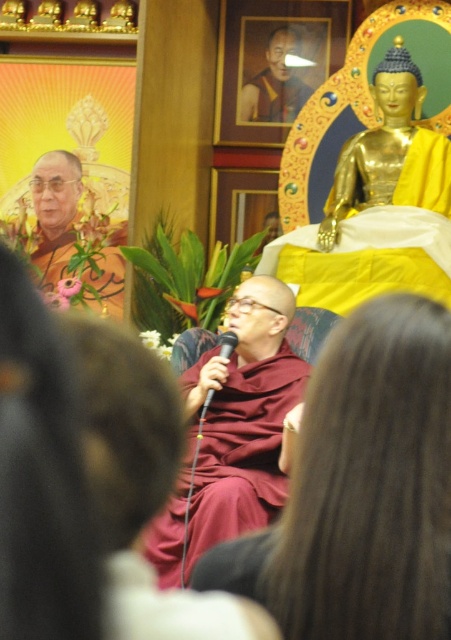
Question: Which point is closer to the camera?

Choices:
 (A) maroon cloth at center
 (B) black plastic microphone at center
 (C) gold polished buddha at upper right
 (D) golden statue at upper left

Answer: (A)

Question: Can you confirm if maroon cloth at center is thinner than golden statue at upper left?

Choices:
 (A) yes
 (B) no

Answer: (B)

Question: Does maroon cloth at center have a larger size compared to golden statue at upper left?

Choices:
 (A) no
 (B) yes

Answer: (B)

Question: Which point is closer to the camera?

Choices:
 (A) gold polished buddha at upper right
 (B) golden statue at upper left

Answer: (A)

Question: Is maroon cloth at center positioned at the back of black plastic microphone at center?

Choices:
 (A) no
 (B) yes

Answer: (A)

Question: Which object is positioned farthest from the golden statue at upper left?

Choices:
 (A) black plastic microphone at center
 (B) gold polished buddha at upper right
 (C) maroon cloth at center

Answer: (A)